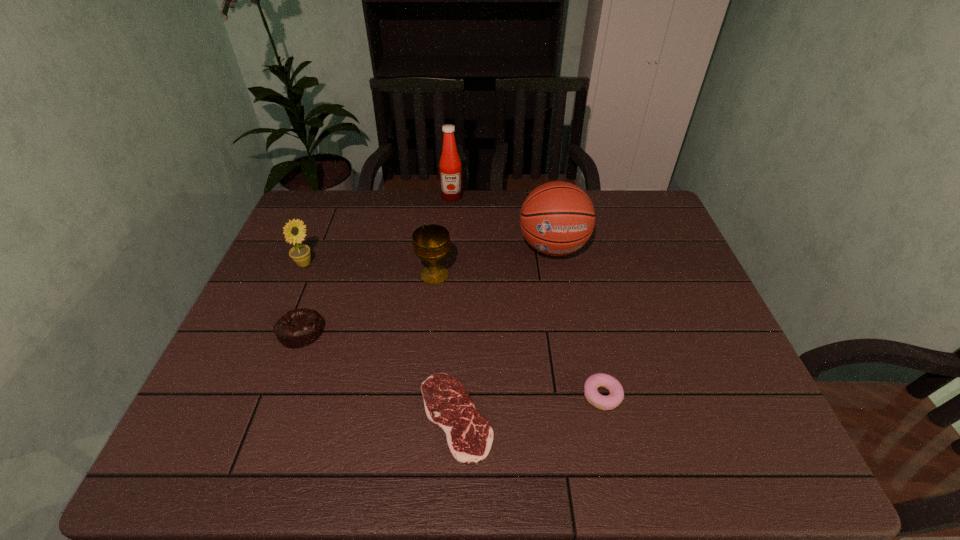
The width and height of the screenshot is (960, 540). I want to click on vacant region located on the logo side of the basketball, so click(x=577, y=377).

Find the location of a particular element. The width and height of the screenshot is (960, 540). vacant space located on the face of the sunflower is located at coordinates (366, 265).

Identify the location of vacant space located on the front of the chalice. This screenshot has width=960, height=540. (426, 356).

Identify the location of vacant space located on the front of the fifth tallest object. (288, 367).

Locate an element on the screen. blank space located on the left of the second shortest object is located at coordinates (551, 396).

Where is `free location located 0.080m on the right of the steak`? free location located 0.080m on the right of the steak is located at coordinates (530, 416).

Identify the location of condiment that is positioned at the far edge. The width and height of the screenshot is (960, 540). (450, 166).

Locate an element on the screen. basketball located in the far edge section of the desktop is located at coordinates (557, 218).

Locate an element on the screen. object situated at the near edge is located at coordinates (469, 435).

At what (x,y) coordinates should I click in order to perform the action: click on sunflower that is at the left edge. Please return your answer as a coordinate pair (x, y). This screenshot has height=540, width=960. Looking at the image, I should click on (300, 254).